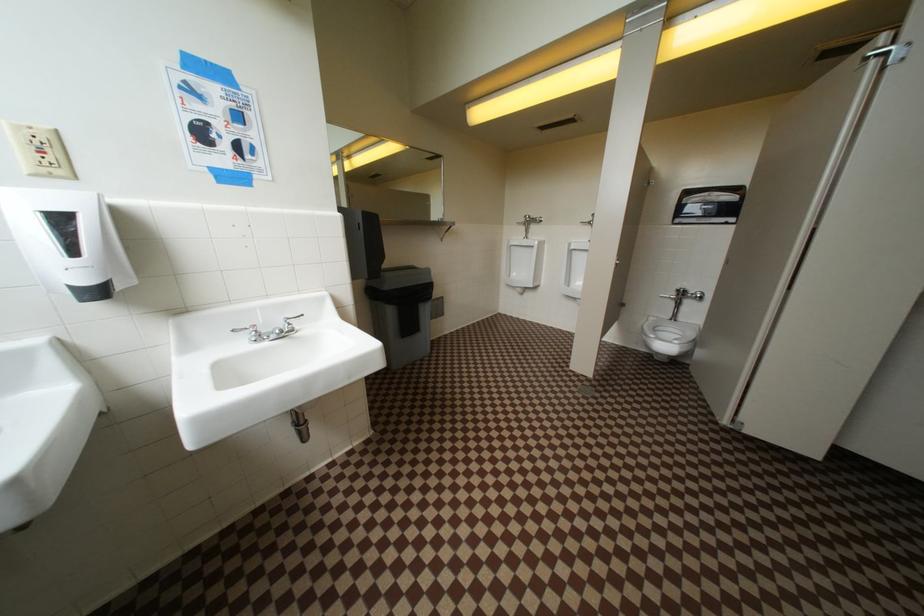
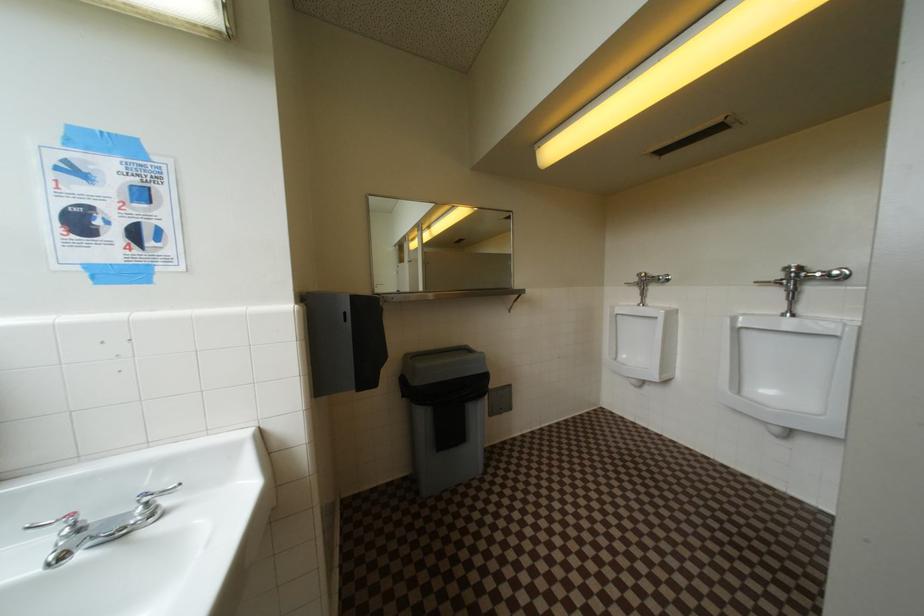
Question: What movement of the cameraman would produce the second image?

Choices:
 (A) Left
 (B) Right
 (C) Forward
 (D) Backward

Answer: (C)